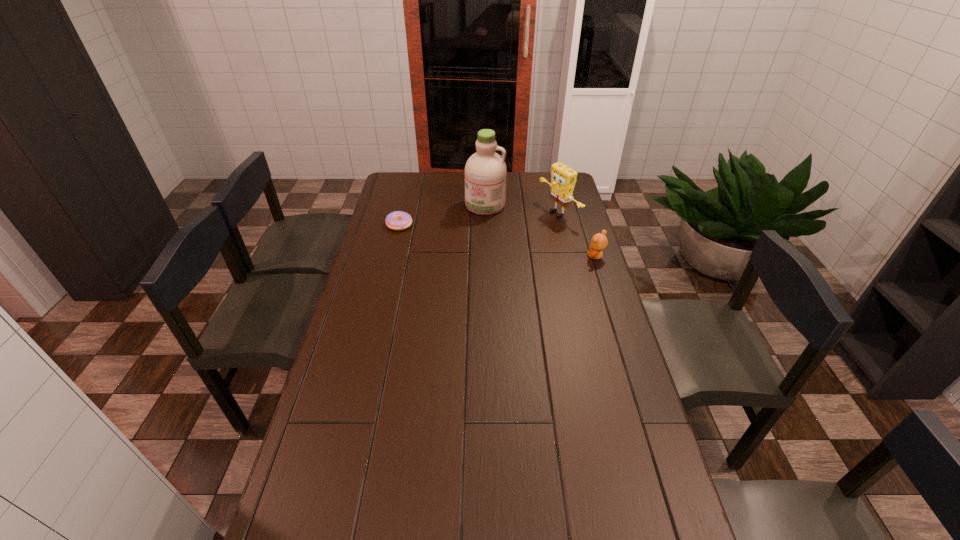
I want to click on free space located on the face of the nearest object, so click(x=528, y=256).

Image resolution: width=960 pixels, height=540 pixels. Identify the location of free spot located 0.220m on the face of the third shortest object. (504, 237).

The image size is (960, 540). Identify the location of vacant area situated on the face of the third shortest object. (514, 233).

You are a GUI agent. You are given a task and a screenshot of the screen. Output one action in this format:
    pyautogui.click(x=<x>, y=<y>)
    Task: Click on the free space located 0.310m on the face of the third shortest object
    This screenshot has height=540, width=960.
    Given the screenshot: What is the action you would take?
    pyautogui.click(x=487, y=243)

Locate an element on the screen. vacant space situated on the front label of the tallest object is located at coordinates (466, 239).

At what (x,y) coordinates should I click in order to perform the action: click on vacant space situated on the front label of the tallest object. Please return your answer as a coordinate pair (x, y). Image resolution: width=960 pixels, height=540 pixels. Looking at the image, I should click on (468, 235).

Find the location of a particular element. Image resolution: width=960 pixels, height=540 pixels. free region located 0.220m on the front label of the tallest object is located at coordinates (464, 243).

The width and height of the screenshot is (960, 540). What are the coordinates of `object that is at the far edge` in the screenshot? It's located at (485, 171).

Locate an element on the screen. object located at the left edge is located at coordinates (398, 220).

The image size is (960, 540). What are the coordinates of `teddy bear that is at the right edge` in the screenshot? It's located at (599, 241).